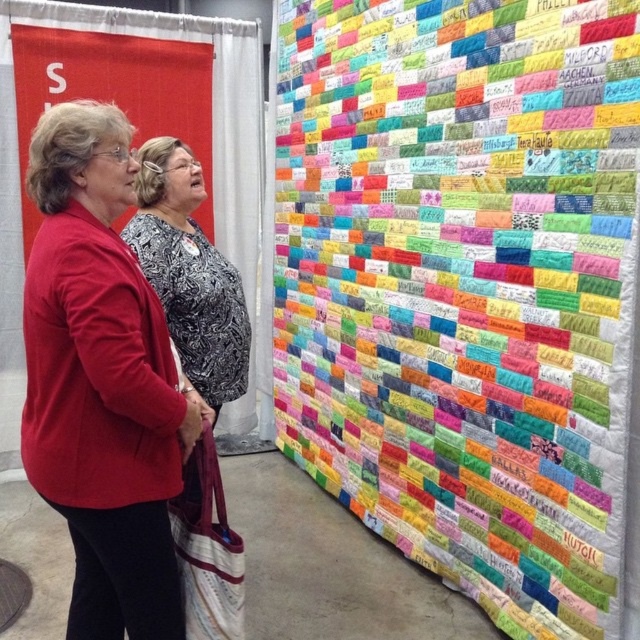
You are an observer standing in front of the quilt wall. You notice two women in front of you wearing the matte red cardigan at center and the patterned fabric blouse at center. Which clothing item is positioned closer to you?

The matte red cardigan at center is closer to the viewer than the patterned fabric blouse at center.